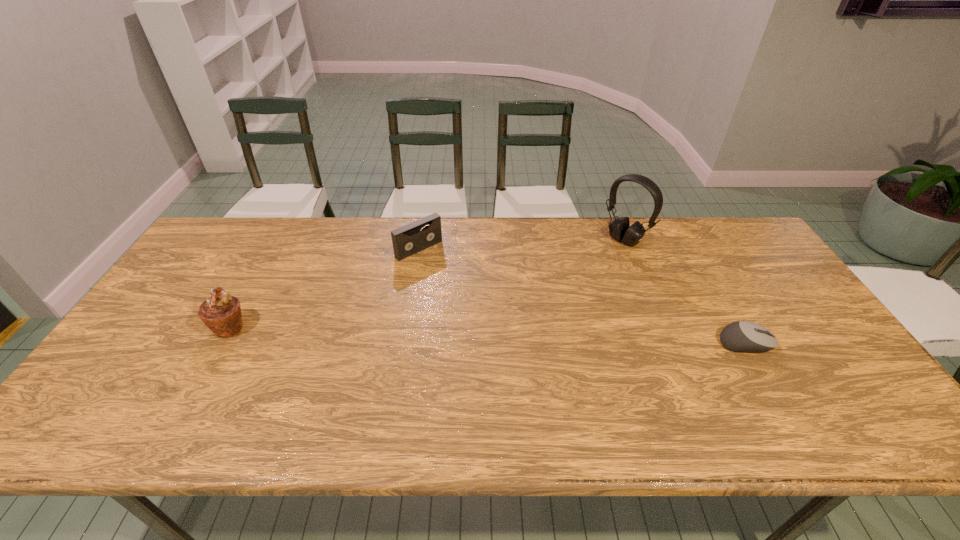
Identify the location of vacant space on the desktop that is between the leftmost object and the computer equipment and is positioned on the front-facing side of the third tallest object. (516, 336).

Find the location of `free space on the desktop that is between the muffin and the shortest object and is positioned on the front-facing side of the headset`. free space on the desktop that is between the muffin and the shortest object and is positioned on the front-facing side of the headset is located at coordinates (510, 336).